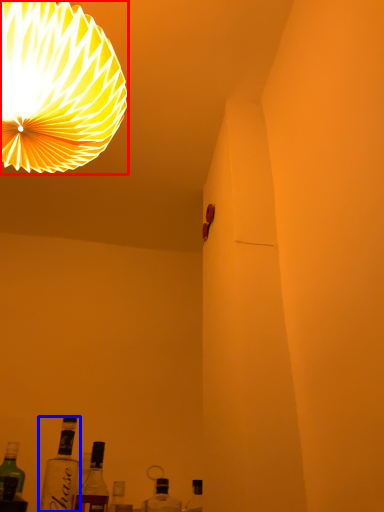
Question: Which object is closer to the camera taking this photo, lamp (highlighted by a red box) or bottle (highlighted by a blue box)?

Choices:
 (A) lamp
 (B) bottle

Answer: (A)